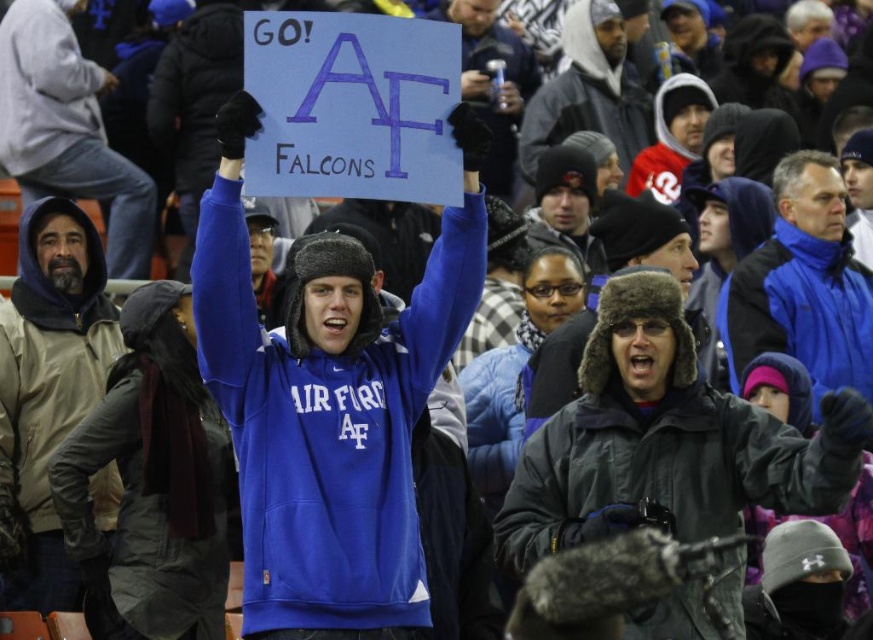
Question: Can you confirm if blue fleece sweatshirt at center is positioned to the left of gray knit hat at upper center?

Choices:
 (A) no
 (B) yes

Answer: (B)

Question: Which of these objects is positioned farthest from the blue fleece jacket at upper right?

Choices:
 (A) beige hooded jacket at left
 (B) dark gray fur-lined hat at center

Answer: (A)

Question: Which object is closer to the camera taking this photo?

Choices:
 (A) dark gray fur-lined jacket at center
 (B) dark gray fur-lined hat at center

Answer: (A)

Question: Which of the following is the closest to the observer?

Choices:
 (A) (322, 608)
 (B) (658, 244)
 (C) (808, 157)
 (D) (59, 602)

Answer: (A)

Question: Is blue fleece jacket at upper right smaller than gray knit hat at upper center?

Choices:
 (A) no
 (B) yes

Answer: (A)

Question: Is beige hooded jacket at left behind gray knit hat at upper center?

Choices:
 (A) yes
 (B) no

Answer: (B)